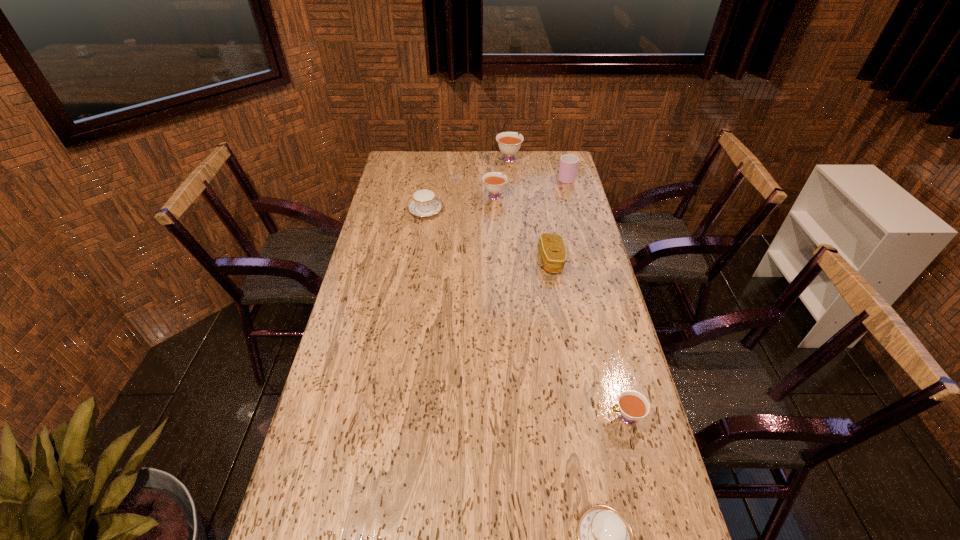
Image resolution: width=960 pixels, height=540 pixels. Identify the location of the biggest white teacup. (509, 143).

Where is `the farthest white teacup`? Image resolution: width=960 pixels, height=540 pixels. the farthest white teacup is located at coordinates (509, 143).

You are a GUI agent. You are given a task and a screenshot of the screen. Output one action in this format:
    pyautogui.click(x=<x>, y=<y>)
    Task: Click on the cup
    This screenshot has height=540, width=960.
    Given the screenshot: What is the action you would take?
    pyautogui.click(x=568, y=166)

Where is `the second smallest white teacup`? the second smallest white teacup is located at coordinates (494, 182).

I want to click on clutch bag, so click(x=552, y=249).

Identify the location of brown clutch bag. (552, 249).

Find the location of a particular element. the leftmost teacup is located at coordinates (424, 203).

This screenshot has width=960, height=540. I want to click on the bigger blue teacup, so click(x=424, y=203).

Identify the location of the second nearest object. The image size is (960, 540). (633, 406).

At what (x,y) coordinates should I click in order to perform the action: click on the rightmost white teacup. Please return your answer as a coordinate pair (x, y). Looking at the image, I should click on (633, 406).